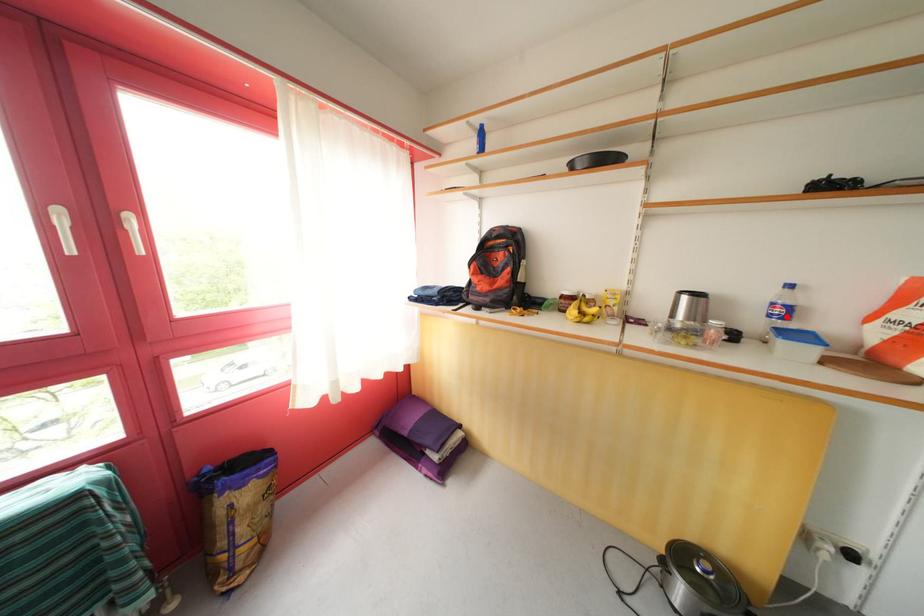
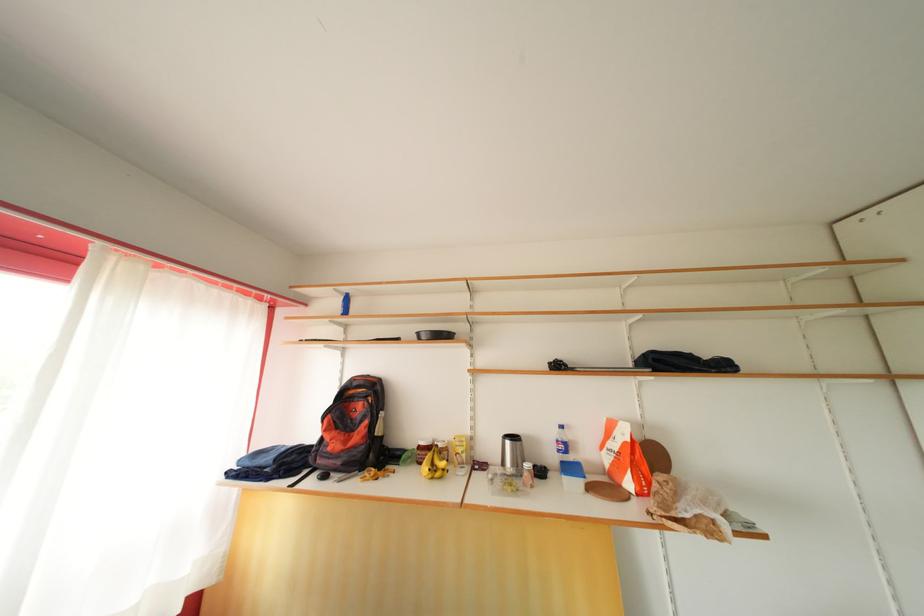
Find the pixel in the second image that matches the highlighted location in the first image.

(568, 453)